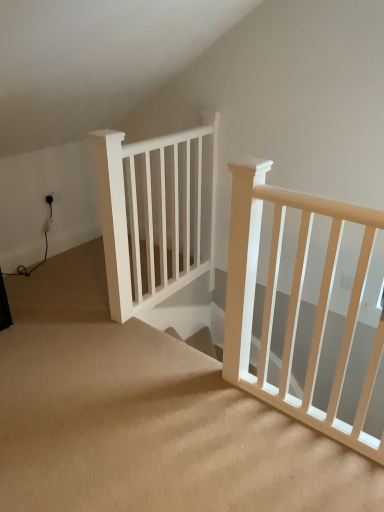
Question: In terms of size, does beige carpeted stairs at center appear bigger or smaller than white wooden rail at center?

Choices:
 (A) big
 (B) small

Answer: (A)

Question: Considering the positions of beige carpeted stairs at center and white wooden rail at center in the image, is beige carpeted stairs at center taller or shorter than white wooden rail at center?

Choices:
 (A) tall
 (B) short

Answer: (B)

Question: Would you say beige carpeted stairs at center is inside or outside white wooden rail at center?

Choices:
 (A) outside
 (B) inside

Answer: (A)

Question: In the image, is white wooden rail at center positioned in front of or behind beige carpeted stairs at center?

Choices:
 (A) front
 (B) behind

Answer: (B)

Question: Considering the positions of white wooden rail at center and beige carpeted stairs at center in the image, is white wooden rail at center bigger or smaller than beige carpeted stairs at center?

Choices:
 (A) small
 (B) big

Answer: (A)

Question: Would you say white wooden rail at center is to the left or to the right of beige carpeted stairs at center in the picture?

Choices:
 (A) right
 (B) left

Answer: (A)

Question: From the image's perspective, is white wooden rail at center located above or below beige carpeted stairs at center?

Choices:
 (A) below
 (B) above

Answer: (B)